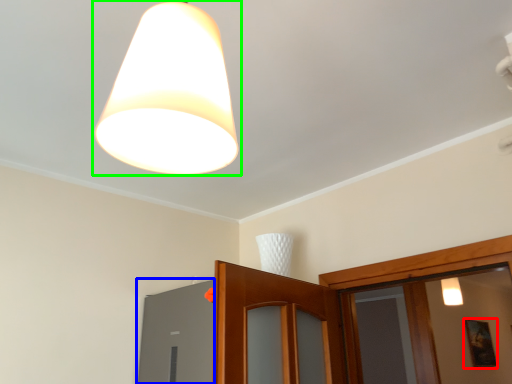
Question: Which object is positioned closest to picture frame (highlighted by a red box)? Select from window (highlighted by a blue box) and lamp (highlighted by a green box).

Choices:
 (A) window
 (B) lamp

Answer: (A)